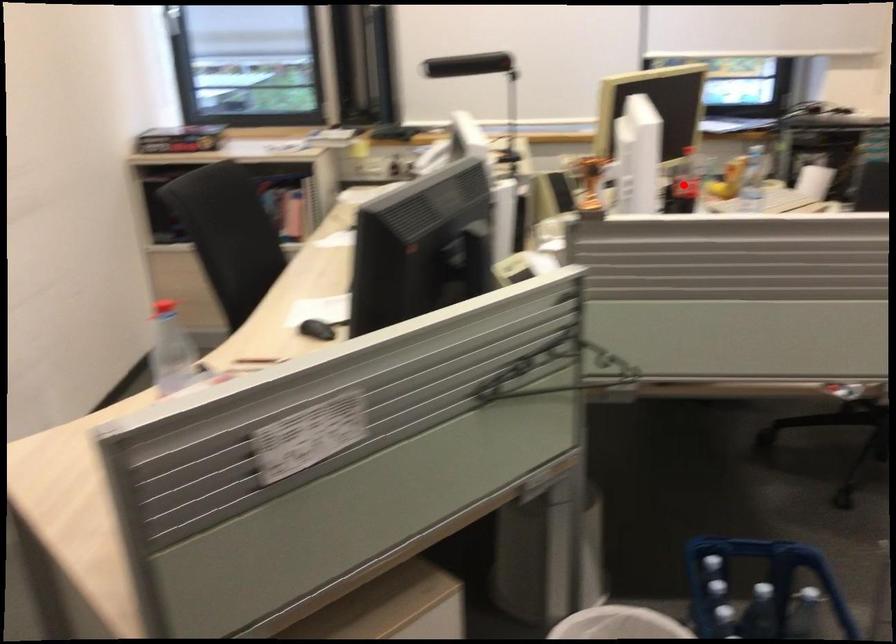
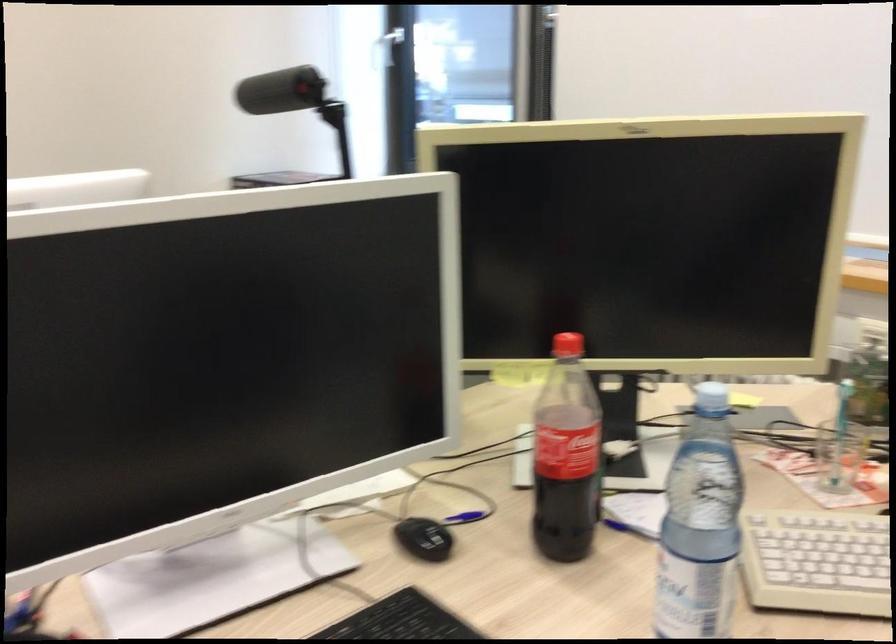
Question: I am providing you with two images of the same scene from different viewpoints. A red point is marked on the first image. At the location where the point appears in image 1, is it still visible in image 2?

Choices:
 (A) Yes
 (B) No

Answer: (A)